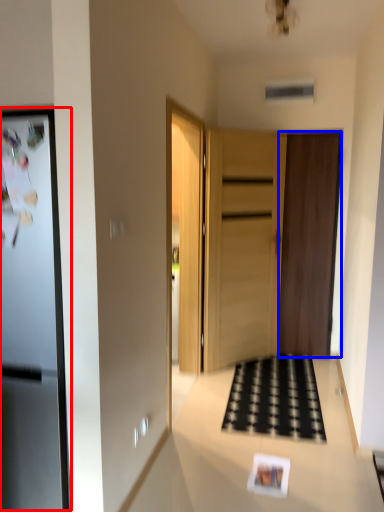
Question: Which object appears closest to the camera in this image, fridge (highlighted by a red box) or door (highlighted by a blue box)?

Choices:
 (A) fridge
 (B) door

Answer: (A)